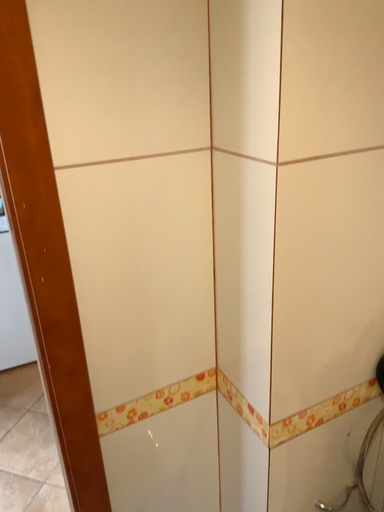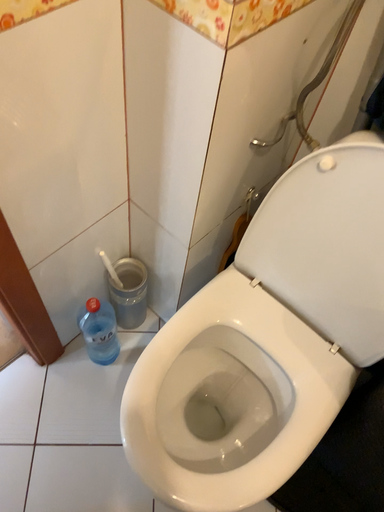
Question: Which way did the camera rotate in the video?

Choices:
 (A) rotated left
 (B) rotated right

Answer: (B)